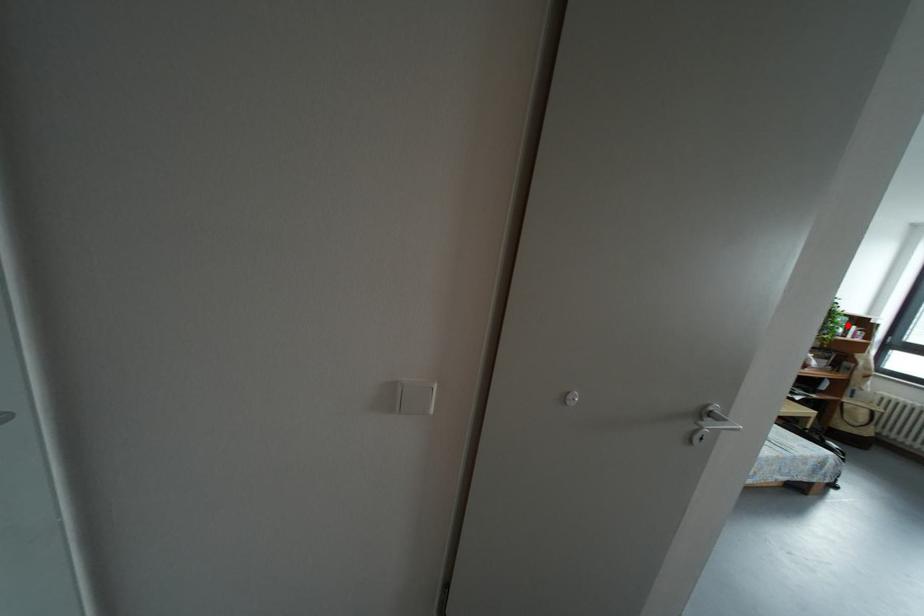
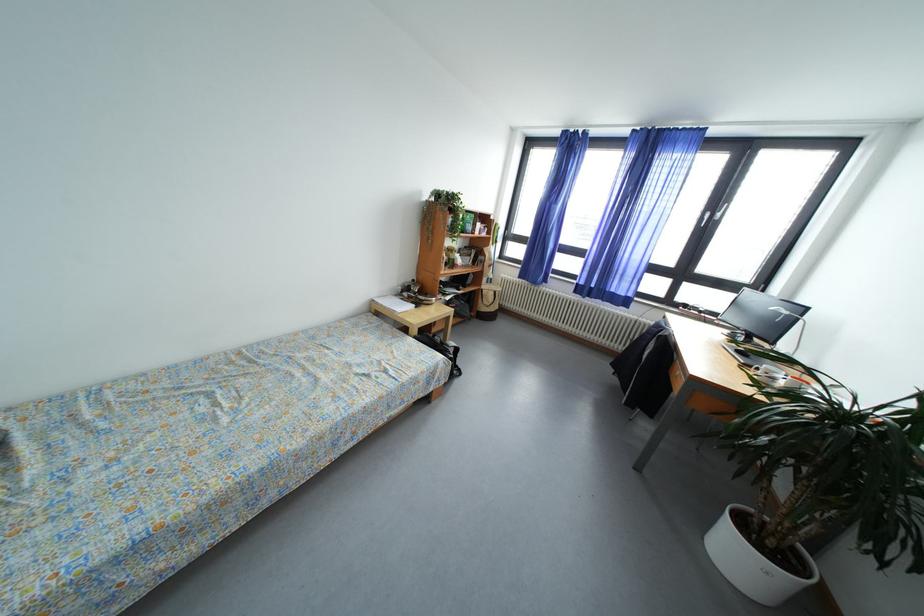
Question: I am providing you with two images of the same scene from different viewpoints. A red point is shown in image1. For the corresponding object point in image2, is it positioned nearer or farther from the camera?

Choices:
 (A) Nearer
 (B) Farther

Answer: (A)